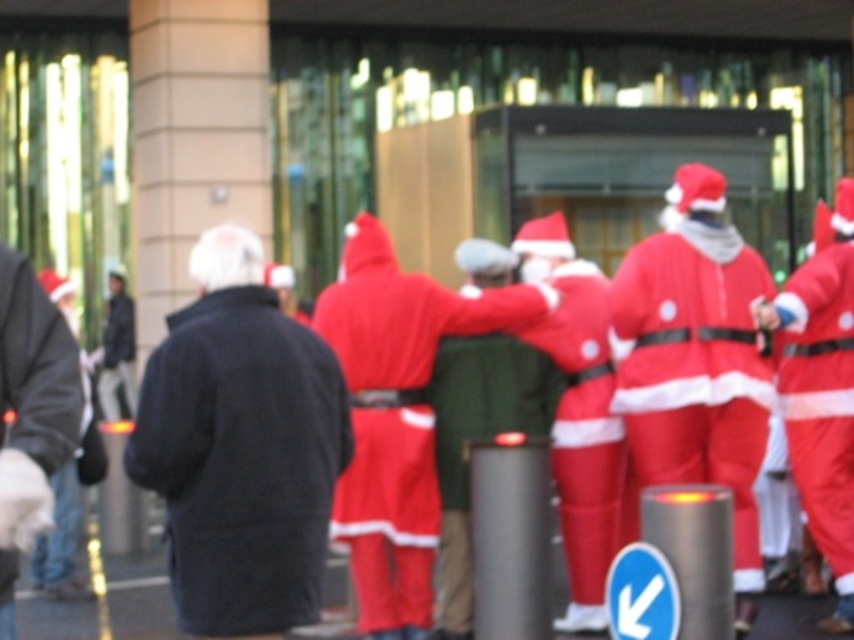
Find the location of a particular element. The image size is (854, 640). matte red santa at right is located at coordinates (822, 394).

Does point (845, 346) lie behind point (51, 349)?

Yes, it is.

Is point (839, 480) more distant than point (56, 324)?

Yes.

This screenshot has height=640, width=854. Find the location of `matte red santa at right`. matte red santa at right is located at coordinates (822, 394).

Can you confirm if dark wool coat at center is positioned above matte red santa at right?

No, dark wool coat at center is not above matte red santa at right.

Between dark wool coat at center and matte red santa at right, which one is positioned higher?

matte red santa at right is higher up.

Find the location of a particular element. The image size is (854, 640). dark wool coat at center is located at coordinates (240, 448).

Does matte red santa at center have a smaller size compared to matte red santa at right?

Yes.

Is matte red santa at center further to the viewer compared to matte red santa at right?

Yes, it is behind matte red santa at right.

The image size is (854, 640). What do you see at coordinates (578, 413) in the screenshot? I see `matte red santa at center` at bounding box center [578, 413].

This screenshot has width=854, height=640. What are the coordinates of `matte red santa at center` in the screenshot? It's located at (578, 413).